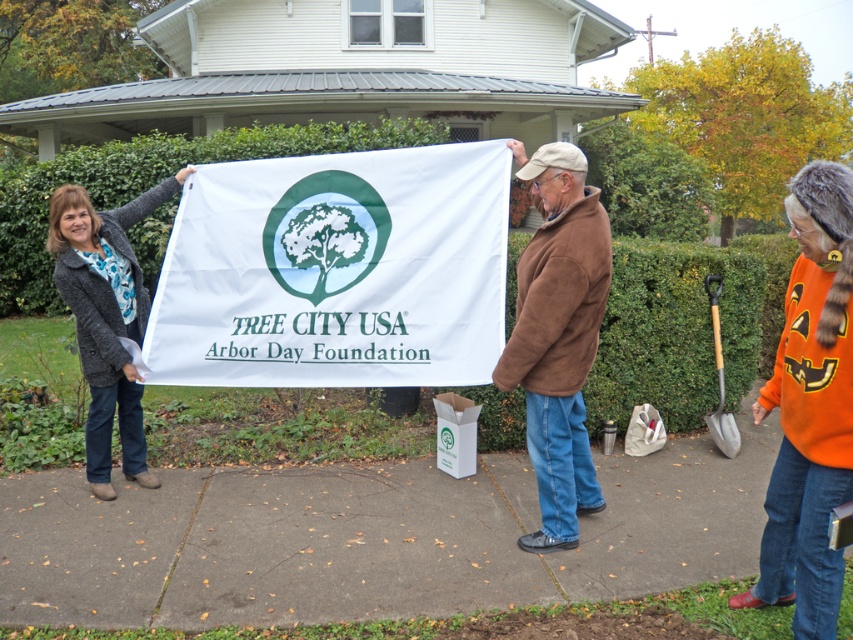
You are a photographer standing in front of the house. You want to take a photo of the white fabric banner at center and the brown fleece jacket at center. Which object is wider in the scene?

The white fabric banner at center is wider than the brown fleece jacket at center.